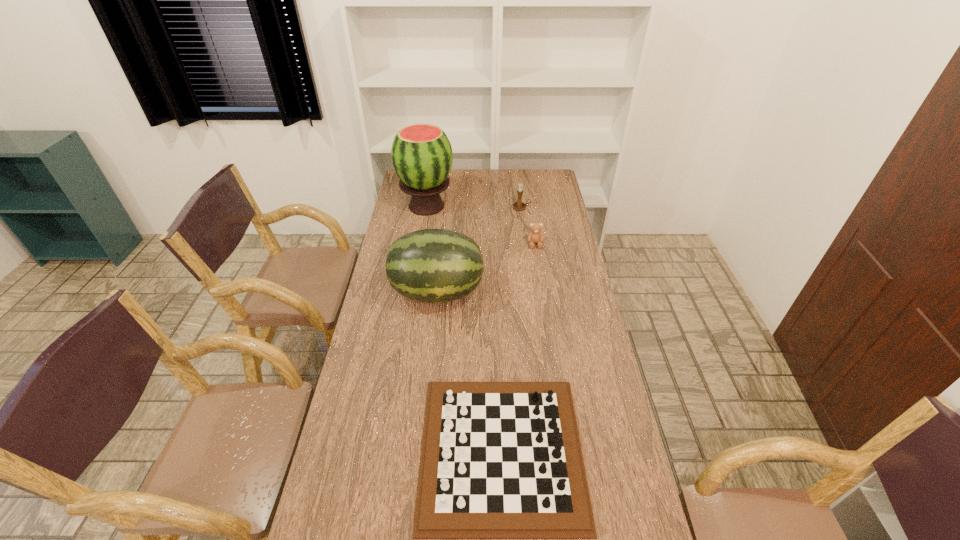
This screenshot has width=960, height=540. I want to click on free space located 0.050m on the back of the shorter watermelon, so click(x=441, y=262).

I want to click on vacant space located 0.060m on the side of the candle holder with the handle, so click(x=542, y=207).

Find the location of `vacant region located on the front-facing side of the teddy bear`. vacant region located on the front-facing side of the teddy bear is located at coordinates (540, 272).

Where is `vacant area situated on the back of the shortest object`? This screenshot has width=960, height=540. vacant area situated on the back of the shortest object is located at coordinates (496, 307).

You are a GUI agent. You are given a task and a screenshot of the screen. Output one action in this format:
    pyautogui.click(x=<x>, y=<y>)
    Task: Click on the object that is at the far edge
    
    Given the screenshot: What is the action you would take?
    pyautogui.click(x=421, y=154)

Find the location of a particular element. teddy bear situated at the right edge is located at coordinates (535, 236).

You are a GUI agent. You are given a task and a screenshot of the screen. Output one action in this format:
    pyautogui.click(x=<x>, y=<y>)
    Task: Click on the gameboard that is at the right edge
    
    Given the screenshot: What is the action you would take?
    pyautogui.click(x=500, y=460)

This screenshot has height=540, width=960. Identify the location of object that is at the far left corner. (421, 154).

Image resolution: width=960 pixels, height=540 pixels. In order to click on vacant area at the far edge of the desktop in this screenshot , I will do `click(469, 177)`.

In the image, there is a desktop. In order to click on vacant space at the left edge in this screenshot , I will do `click(360, 368)`.